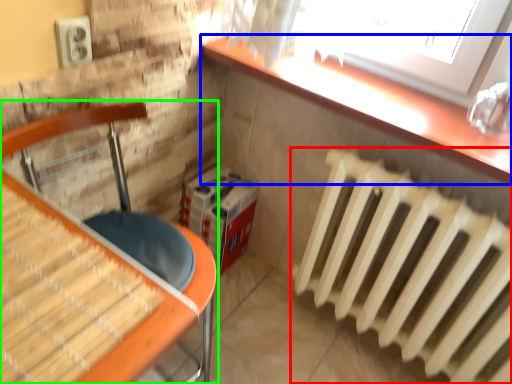
Question: Which object is the closest to the radiator (highlighted by a red box)? Choose among these: counter top (highlighted by a blue box) or furniture (highlighted by a green box).

Choices:
 (A) counter top
 (B) furniture

Answer: (A)